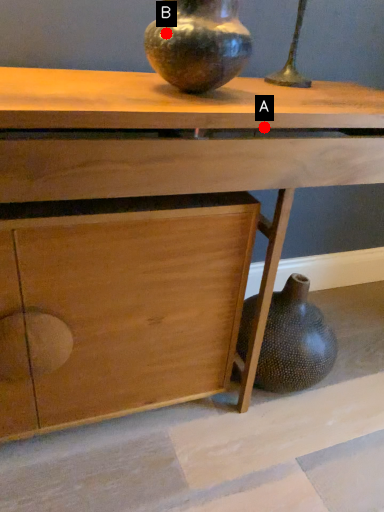
Question: Two points are circled on the image, labeled by A and B beside each circle. Which point is farther from the camera taking this photo?

Choices:
 (A) A is further
 (B) B is further

Answer: (B)